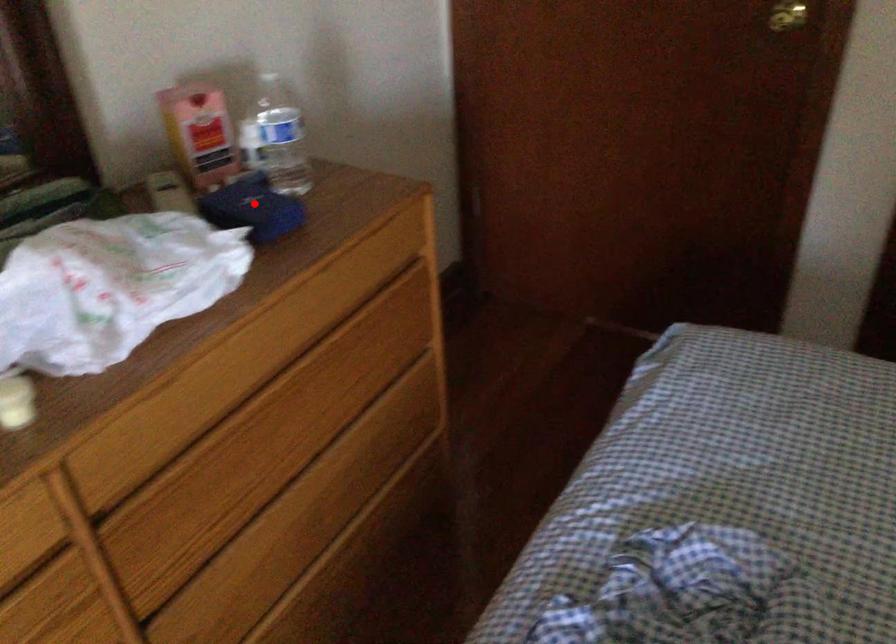
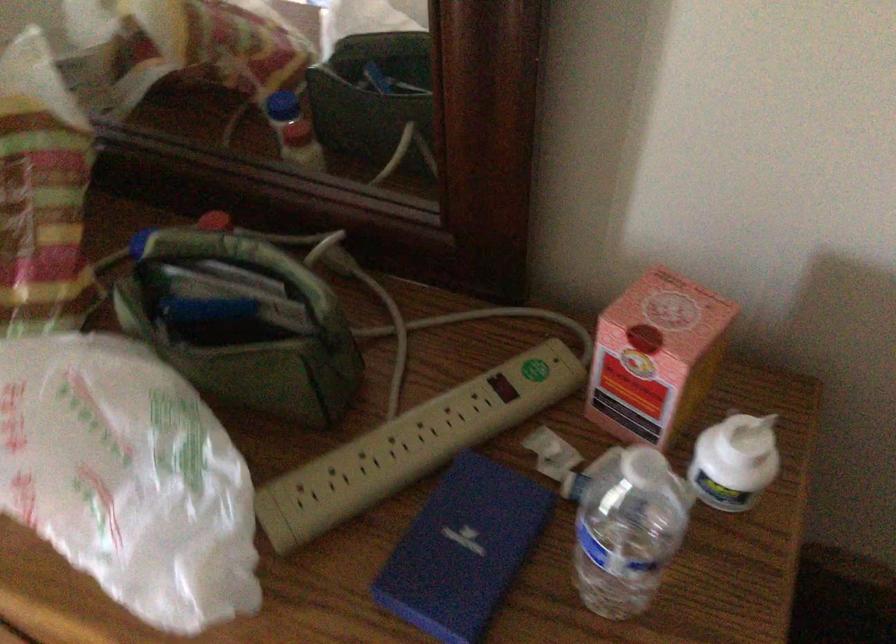
Question: I am providing you with two images of the same scene from different viewpoints. Given a red point in image1, look at the same physical point in image2. Is it:

Choices:
 (A) Closer to the viewpoint
 (B) Farther from the viewpoint

Answer: (A)